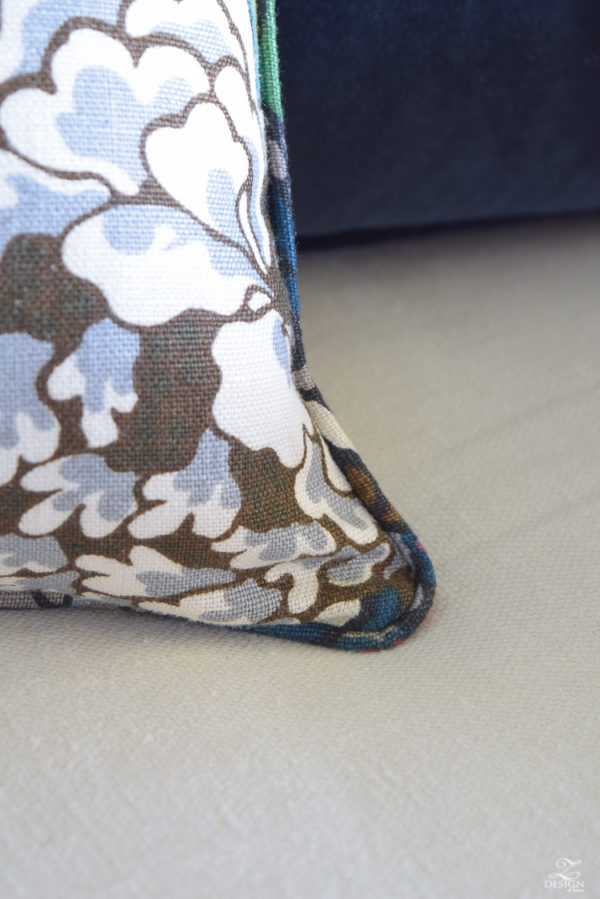
Image resolution: width=600 pixels, height=899 pixels. What are the coordinates of `arm of couch` in the screenshot? It's located at (427, 131).